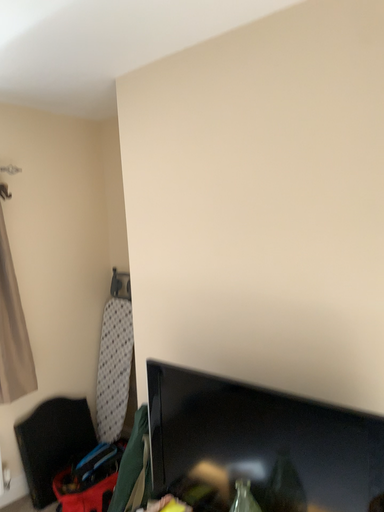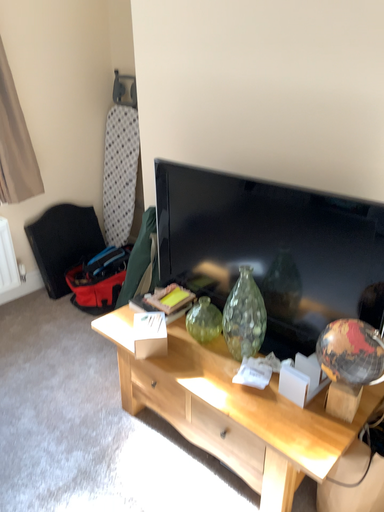
Question: Which way did the camera rotate in the video?

Choices:
 (A) rotated upward
 (B) rotated downward

Answer: (B)